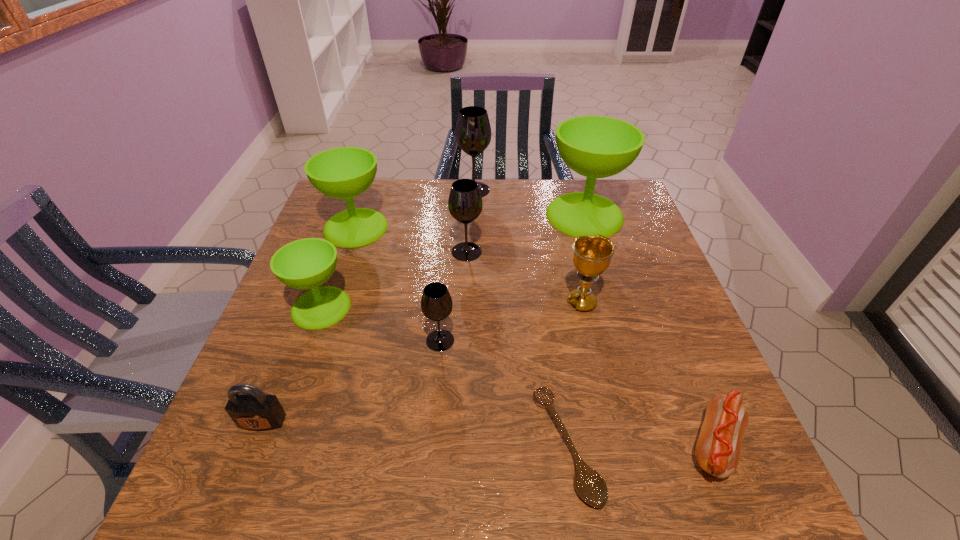
Find the location of a particular element. This screenshot has width=960, height=540. wineglass that is the third nearest to the farthest gray wineglass is located at coordinates (465, 203).

Select which gray wineglass appears as the closest to the second nearest gray wineglass. Please provide its 2D coordinates. Your answer should be formatted as a tuple, i.e. [(x, y)], where the tuple contains the x and y coordinates of a point satisfying the conditions above.

[(473, 131)]

This screenshot has width=960, height=540. In order to click on the closest gray wineglass to the second biggest gray wineglass in this screenshot , I will do `click(473, 131)`.

Find the location of a particular element. The height and width of the screenshot is (540, 960). the third closest green wineglass relative to the eighth tallest object is located at coordinates (595, 147).

Identify which green wineglass is the second closest to the second smallest green wineglass. Please provide its 2D coordinates. Your answer should be formatted as a tuple, i.e. [(x, y)], where the tuple contains the x and y coordinates of a point satisfying the conditions above.

[(595, 147)]

The height and width of the screenshot is (540, 960). What are the coordinates of `free location that satisfies the following two spatial constraints: 1. on the front side of the brown sausage; 2. on the right side of the chalice` in the screenshot? It's located at (615, 446).